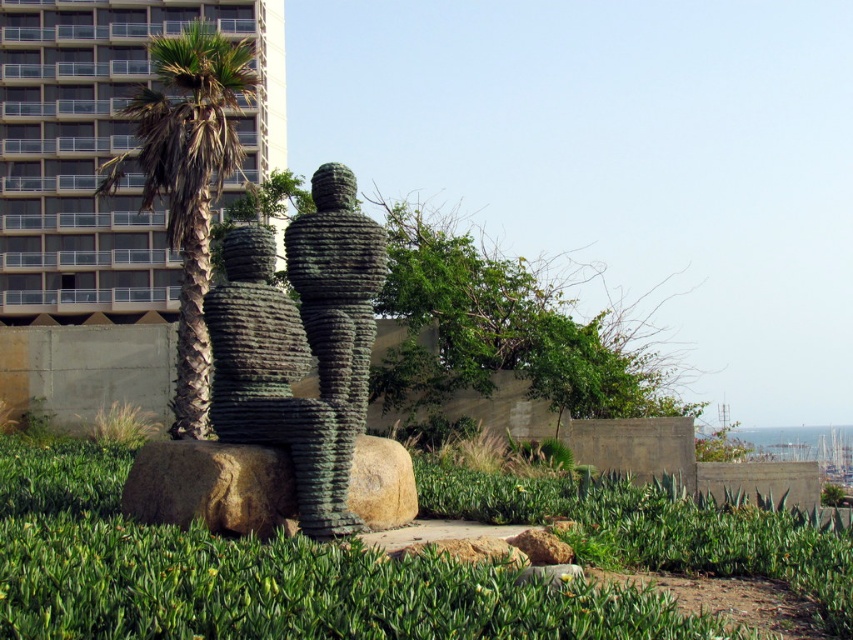
You are standing at the center of the urban landscape and want to take a photo of the gray concrete building at upper left. Which direction should you face to capture it in your view?

The gray concrete building at upper left is located at point (103, 152), so you should face towards the upper left direction to capture it in your view.

You are standing in the urban landscape and want to place a small decorative stone exactly at the center of the green leafy grass at center. According to the coordinates provided, where should you place the stone?

The green leafy grass at center is located at coordinates point (248, 573), so you should place the small decorative stone at point (248, 573) to be exactly at its center.

Looking at this image, you are a landscape architect designing a garden layout. You have to place the green leafy grass at center and the green textured palm tree at left in such a way that they don not overcrowd each other. Based on the image, which object should you allocate more space for to ensure proper growth and visibility?

The green textured palm tree at left requires more space since it occupies more area than the green leafy grass at center according to the description.